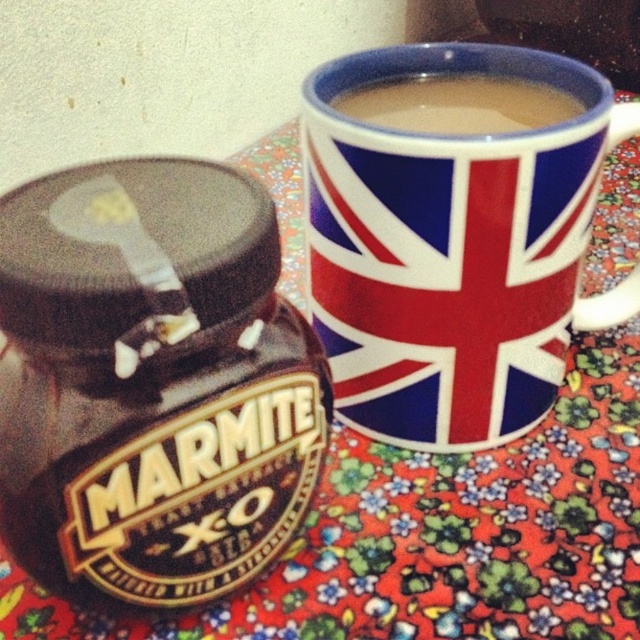
You are a photographer trying to capture a closeup of the shiny brown marmite jar at left. If your camera requires the subject to be within 30 centimeters for optimal focus, will you need to move closer or farther away?

The shiny brown marmite jar at left is currently 33.94 centimeters away from the camera. Since this is beyond the 30 centimeter requirement for optimal focus, you will need to move closer to achieve the best results.

You are a chef preparing a meal and need to place both the shiny brown marmite jar at left and the smooth ceramic mug at upper center on a shelf. The shelf is 12 inches wide. Can both items fit side by side without overlapping?

The shiny brown marmite jar at left and the smooth ceramic mug at upper center are 10.56 inches apart, so they can fit side by side on the 12 inch wide shelf since the total space needed is less than the shelf width.

You are arranging items on a table and need to place both the shiny brown marmite jar at left and the smooth ceramic mug at upper center. Based on their current positions, which item is closer to you?

The shiny brown marmite jar at left is closer to you because it is in front of the smooth ceramic mug at upper center.